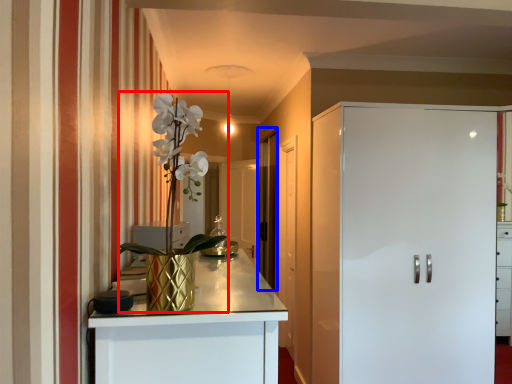
Question: Which of the following is the farthest to the observer, floral arrangement (highlighted by a red box) or glass door (highlighted by a blue box)?

Choices:
 (A) floral arrangement
 (B) glass door

Answer: (B)